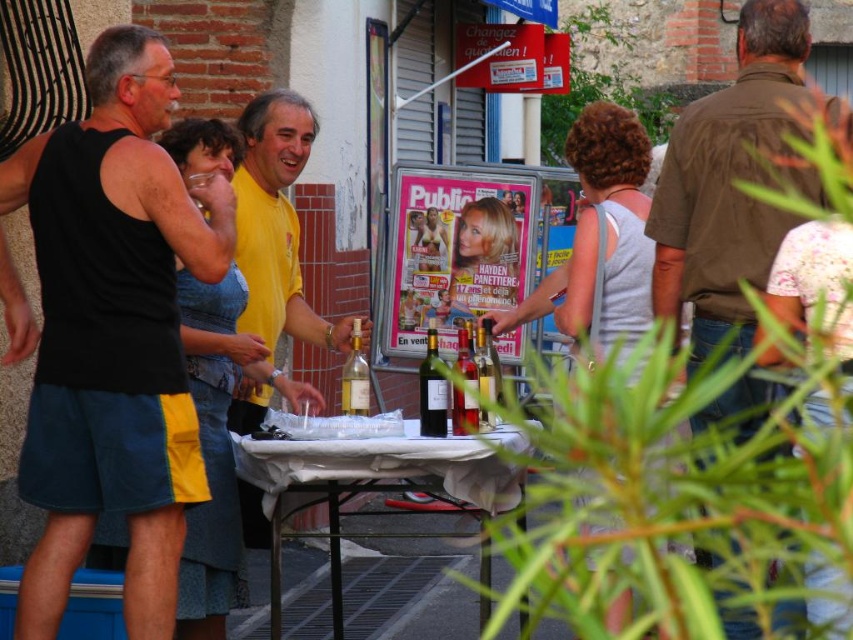
You are at a wine tasting event and see two people near the table with wine bottles. The black fabric tank top at left and the yellow cotton shirt at center are both present. Which person is positioned closer to the left side of the scene?

The black fabric tank top at left is positioned to the left of the yellow cotton shirt at center, so the person wearing the black fabric tank top at left is closer to the left side of the scene.